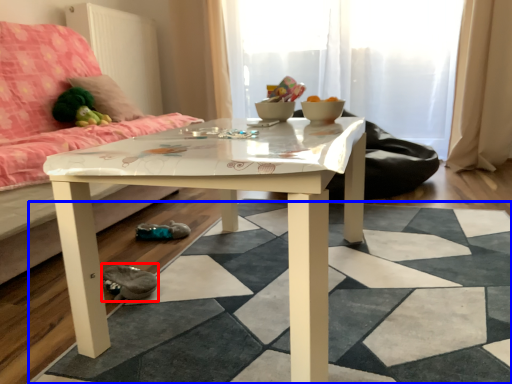
Question: Among these objects, which one is nearest to the camera, shoe (highlighted by a red box) or square (highlighted by a blue box)?

Choices:
 (A) shoe
 (B) square

Answer: (B)